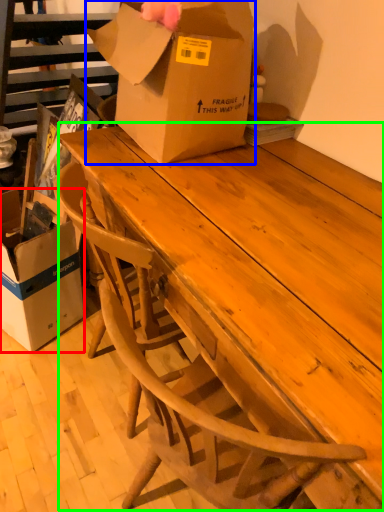
Question: Considering the real-world distances, which object is farthest from box (highlighted by a red box)? box (highlighted by a blue box) or table (highlighted by a green box)?

Choices:
 (A) box
 (B) table

Answer: (B)